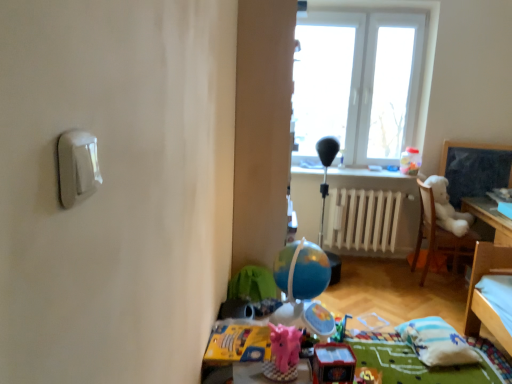
Find the location of a particular element. This screenshot has height=384, width=512. white plastic window at upper center is located at coordinates (376, 53).

Locate an element on the screen. This screenshot has height=384, width=512. white plush bear at right is located at coordinates (439, 234).

What do you see at coordinates (447, 208) in the screenshot?
I see `white plush bear at right` at bounding box center [447, 208].

Image resolution: width=512 pixels, height=384 pixels. Describe the element at coordinates (362, 219) in the screenshot. I see `white painted metal radiator at center` at that location.

Image resolution: width=512 pixels, height=384 pixels. What do you see at coordinates (436, 342) in the screenshot?
I see `white soft pillow at lower right` at bounding box center [436, 342].

Describe the element at coordinates (333, 363) in the screenshot. The image size is (512, 384). I see `rubber red toy car at lower center, which ranks as the second toy in right-to-left order` at that location.

This screenshot has height=384, width=512. In order to click on white plastic window at upper center in this screenshot , I will do `click(376, 53)`.

Is white painted metal radiator at center wider or thinner than white plastic light switch at upper left?

Clearly, white painted metal radiator at center has more width compared to white plastic light switch at upper left.

Looking at this image, does white painted metal radiator at center lie behind white plastic light switch at upper left?

Yes, white painted metal radiator at center is behind white plastic light switch at upper left.

Is white painted metal radiator at center positioned with its back to white plastic light switch at upper left?

Answer: No, white painted metal radiator at center is not facing away from white plastic light switch at upper left.

Is white painted metal radiator at center smaller than white plastic light switch at upper left?

No, white painted metal radiator at center is not smaller than white plastic light switch at upper left.

Considering the sizes of objects white plush bear at right and white plastic window at upper center in the image provided, who is smaller, white plush bear at right or white plastic window at upper center?

Smaller between the two is white plush bear at right.

Which object is positioned more to the left, white plush bear at right or white plastic window at upper center?

From the viewer's perspective, white plastic window at upper center appears more on the left side.

Between white plush bear at right and white plastic window at upper center, which one is positioned in front?

white plush bear at right.

Is white plush bear at right oriented towards white plastic window at upper center?

No.

Which object is wider, white soft pillow at lower right or rubber red toy car at lower center, which appears as the second toy when viewed from the left?

white soft pillow at lower right is wider.

From the image's perspective, is white soft pillow at lower right below rubber red toy car at lower center, which ranks as the second toy in right-to-left order?

Yes, from the image's perspective, white soft pillow at lower right is beneath rubber red toy car at lower center, which ranks as the second toy in right-to-left order.

Is white soft pillow at lower right to the left or to the right of rubber red toy car at lower center, arranged as the first toy when ordered from the bottom, in the image?

From the image, it's evident that white soft pillow at lower right is to the right of rubber red toy car at lower center, arranged as the first toy when ordered from the bottom.

Considering the relative sizes of white soft pillow at lower right and rubber red toy car at lower center, which appears as the second toy when viewed from the left, in the image provided, is white soft pillow at lower right smaller than rubber red toy car at lower center, which appears as the second toy when viewed from the left,?

No, white soft pillow at lower right is not smaller than rubber red toy car at lower center, which appears as the second toy when viewed from the left.

In the image, is white painted metal radiator at center positioned in front of or behind rubber red toy car at lower center, which ranks as the second toy in right-to-left order?

white painted metal radiator at center is positioned farther from the viewer than rubber red toy car at lower center, which ranks as the second toy in right-to-left order.

Identify the location of the 3rd toy in front of the white painted metal radiator at center, starting your count from the anchor. (333, 363).

Are white painted metal radiator at center and rubber red toy car at lower center, arranged as the 3th toy when viewed from the back, making contact?

white painted metal radiator at center and rubber red toy car at lower center, arranged as the 3th toy when viewed from the back, are clearly separated.

Does pink fabric stuffed animal at center, which is counted as the 3th toy, starting from the right, have a greater width compared to white plastic window at upper center?

Correct, the width of pink fabric stuffed animal at center, which is counted as the 3th toy, starting from the right, exceeds that of white plastic window at upper center.

Is pink fabric stuffed animal at center, the second toy when ordered from bottom to top, closer to the viewer compared to white plastic window at upper center?

Yes, pink fabric stuffed animal at center, the second toy when ordered from bottom to top, is in front of white plastic window at upper center.

Find the location of a particular element. window behind the pink fabric stuffed animal at center, the second toy positioned from the back is located at coordinates (376, 53).

Is the position of rubber red toy car at lower center, which ranks as the second toy in right-to-left order, less distant than that of white painted metal radiator at center?

That is True.

Which is behind, point (320, 345) or point (391, 201)?

The point (391, 201) is more distant.

In the scene shown: From the image's perspective, is rubber red toy car at lower center, the 1th toy from the front, under white painted metal radiator at center?

Yes, from the image's perspective, rubber red toy car at lower center, the 1th toy from the front, is below white painted metal radiator at center.

From a real-world perspective, is white painted metal radiator at center physically above translucent plastic container at upper right, acting as the first toy starting from the right?

No, from a real-world perspective, white painted metal radiator at center is not above translucent plastic container at upper right, acting as the first toy starting from the right.

Is white painted metal radiator at center turned away from translucent plastic container at upper right, positioned as the third toy in front-to-back order?

No, white painted metal radiator at center is not facing the opposite direction of translucent plastic container at upper right, positioned as the third toy in front-to-back order.

How different are the orientations of white painted metal radiator at center and translucent plastic container at upper right, acting as the first toy starting from the right, in degrees?

0.387 degrees separate the facing orientations of white painted metal radiator at center and translucent plastic container at upper right, acting as the first toy starting from the right.

I want to click on light switch located above the white painted metal radiator at center (from a real-world perspective), so click(77, 166).

Find the location of a particular element. chair to the right of white plastic window at upper center is located at coordinates (439, 234).

Which object lies nearer to the anchor point rubber red toy car at lower center, the 1th toy from the front, white plastic window at upper center or pink fabric stuffed animal at center, the second toy when ordered from bottom to top?

Among the two, pink fabric stuffed animal at center, the second toy when ordered from bottom to top, is located nearer to rubber red toy car at lower center, the 1th toy from the front.

From the image, which object appears to be nearer to white plush bear at right, pink fabric stuffed animal at center, placed as the 1th toy when sorted from left to right, or rubber red toy car at lower center, arranged as the third toy when viewed from the top?

Among the two, rubber red toy car at lower center, arranged as the third toy when viewed from the top, is located nearer to white plush bear at right.

Considering their positions, is white soft pillow at lower right positioned further to rubber red toy car at lower center, arranged as the 3th toy when viewed from the back, than pink fabric stuffed animal at center, marked as the 2th toy in a front-to-back arrangement?

Among the two, white soft pillow at lower right is located further to rubber red toy car at lower center, arranged as the 3th toy when viewed from the back.

Which object lies further to the anchor point white plastic window at upper center, rubber red toy car at lower center, arranged as the 3th toy when viewed from the back, or white painted metal radiator at center?

rubber red toy car at lower center, arranged as the 3th toy when viewed from the back, is further to white plastic window at upper center.

From the image, which object appears to be nearer to white painted metal radiator at center, translucent plastic container at upper right, which is the third toy from bottom to top, or white plush bear at right?

Based on the image, white plush bear at right appears to be nearer to white painted metal radiator at center.

From the image, which object appears to be nearer to rubber red toy car at lower center, arranged as the third toy when viewed from the top, white plush bear at right or white soft pillow at lower right?

white soft pillow at lower right is positioned closer to the anchor rubber red toy car at lower center, arranged as the third toy when viewed from the top.

From the image, which object appears to be farther from white soft pillow at lower right, rubber red toy car at lower center, which ranks as the second toy in right-to-left order, or translucent plastic container at upper right, which is the third toy from bottom to top?

translucent plastic container at upper right, which is the third toy from bottom to top, is further to white soft pillow at lower right.

Considering their positions, is translucent plastic container at upper right, placed as the 1th toy when sorted from top to bottom, positioned further to pink fabric stuffed animal at center, the second toy positioned from the back, than white soft pillow at lower right?

translucent plastic container at upper right, placed as the 1th toy when sorted from top to bottom, is positioned further to the anchor pink fabric stuffed animal at center, the second toy positioned from the back.

This screenshot has width=512, height=384. I want to click on chair between rubber red toy car at lower center, the 1th toy from the front, and white painted metal radiator at center in the front-back direction, so click(439, 234).

You are a GUI agent. You are given a task and a screenshot of the screen. Output one action in this format:
    pyautogui.click(x=<x>, y=<y>)
    Task: Click on the animal between white plastic window at upper center and white plush bear at right vertically
    
    Given the screenshot: What is the action you would take?
    pyautogui.click(x=447, y=208)

The width and height of the screenshot is (512, 384). I want to click on animal positioned between rubber red toy car at lower center, which appears as the second toy when viewed from the left, and white plastic window at upper center from near to far, so click(447, 208).

This screenshot has height=384, width=512. Identify the location of chair between rubber red toy car at lower center, arranged as the third toy when viewed from the top, and translucent plastic container at upper right, acting as the first toy starting from the right, in the front-back direction. (439, 234).